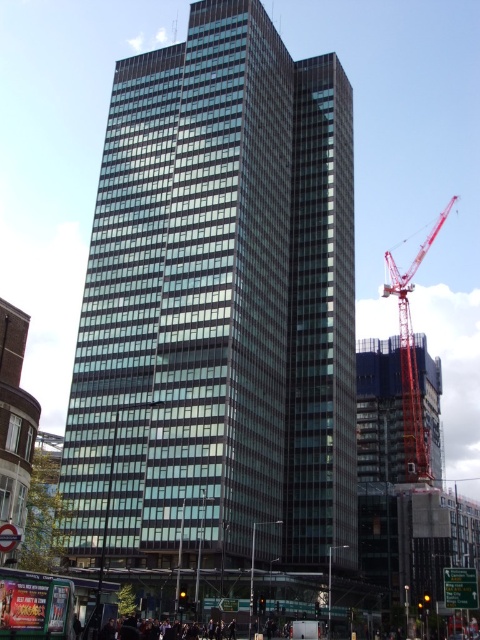
Is point (214, 214) positioned behind point (410, 380)?

No, (214, 214) is closer to viewer.

Who is taller, glassy steel skyscraper at center or red metallic crane at right?

With more height is red metallic crane at right.

Who is more forward, (x=282, y=540) or (x=405, y=333)?

Point (x=282, y=540) is more forward.

This screenshot has width=480, height=640. Identify the location of glassy steel skyscraper at center. pos(218,308).